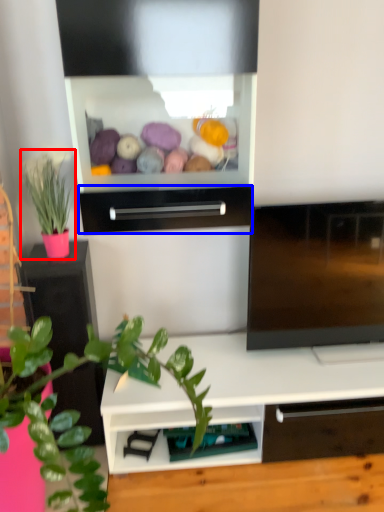
Question: Which object appears farthest to the camera in this image, houseplant (highlighted by a red box) or drawer (highlighted by a blue box)?

Choices:
 (A) houseplant
 (B) drawer

Answer: (A)